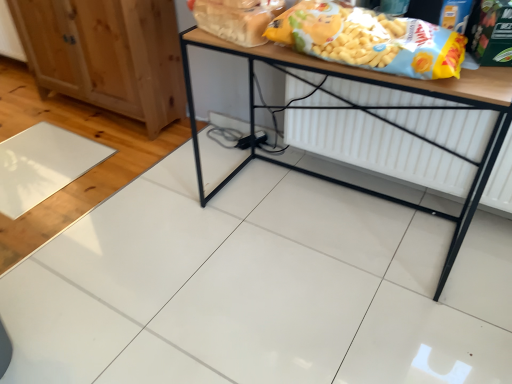
What is the approximate height of white matte radiator at lower center?

white matte radiator at lower center is 16.61 inches in height.

The height and width of the screenshot is (384, 512). I want to click on yellow matte cereal at upper right, positioned as the second cereal in left-to-right order, so click(370, 40).

What do you see at coordinates (106, 54) in the screenshot?
I see `natural wood cabinet at left` at bounding box center [106, 54].

I want to click on translucent plastic bag of bread at upper center, positioned as the second cereal in right-to-left order, so click(x=236, y=18).

From a real-world perspective, is natural wood cabinet at left positioned under translucent plastic bag of bread at upper center, which is counted as the 1th cereal, starting from the left, based on gravity?

Indeed, from a real-world perspective, natural wood cabinet at left is positioned beneath translucent plastic bag of bread at upper center, which is counted as the 1th cereal, starting from the left.

Visually, is natural wood cabinet at left positioned to the left or to the right of translucent plastic bag of bread at upper center, which is counted as the 1th cereal, starting from the left?

From the image, it's evident that natural wood cabinet at left is to the left of translucent plastic bag of bread at upper center, which is counted as the 1th cereal, starting from the left.

How far apart are natural wood cabinet at left and translucent plastic bag of bread at upper center, positioned as the second cereal in right-to-left order?

natural wood cabinet at left is 38.53 inches away from translucent plastic bag of bread at upper center, positioned as the second cereal in right-to-left order.

Considering the positions of points (193, 11) and (376, 49), is point (193, 11) farther from camera compared to point (376, 49)?

Yes, it is.

From a real-world perspective, which object rests below the other?

translucent plastic bag of bread at upper center, which is counted as the 1th cereal, starting from the left, from a real-world perspective.

Is translucent plastic bag of bread at upper center, positioned as the second cereal in right-to-left order, wider than yellow matte cereal at upper right, acting as the first cereal starting from the right?

In fact, translucent plastic bag of bread at upper center, positioned as the second cereal in right-to-left order, might be narrower than yellow matte cereal at upper right, acting as the first cereal starting from the right.

How different are the orientations of translucent plastic bag of bread at upper center, which is counted as the 1th cereal, starting from the left, and yellow matte cereal at upper right, positioned as the second cereal in left-to-right order, in degrees?

16.4 degrees.

From a real-world perspective, is yellow matte cereal at upper right, acting as the first cereal starting from the right, physically above natural wood cabinet at left?

Indeed, from a real-world perspective, yellow matte cereal at upper right, acting as the first cereal starting from the right, stands above natural wood cabinet at left.

Does yellow matte cereal at upper right, acting as the first cereal starting from the right, contain natural wood cabinet at left?

Actually, natural wood cabinet at left is outside yellow matte cereal at upper right, acting as the first cereal starting from the right.

Can you confirm if yellow matte cereal at upper right, positioned as the second cereal in left-to-right order, is smaller than natural wood cabinet at left?

Correct, yellow matte cereal at upper right, positioned as the second cereal in left-to-right order, occupies less space than natural wood cabinet at left.

From the image's perspective, is yellow matte cereal at upper right, acting as the first cereal starting from the right, under natural wood cabinet at left?

Yes.

Could you measure the distance between yellow matte cereal at upper right, acting as the first cereal starting from the right, and translucent plastic bag of bread at upper center, which is counted as the 1th cereal, starting from the left?

yellow matte cereal at upper right, acting as the first cereal starting from the right, and translucent plastic bag of bread at upper center, which is counted as the 1th cereal, starting from the left, are 8.55 inches apart from each other.

Is yellow matte cereal at upper right, positioned as the second cereal in left-to-right order, next to translucent plastic bag of bread at upper center, positioned as the second cereal in right-to-left order?

No, yellow matte cereal at upper right, positioned as the second cereal in left-to-right order, is not in contact with translucent plastic bag of bread at upper center, positioned as the second cereal in right-to-left order.

Which object is further away from the camera, yellow matte cereal at upper right, acting as the first cereal starting from the right, or translucent plastic bag of bread at upper center, positioned as the second cereal in right-to-left order?

translucent plastic bag of bread at upper center, positioned as the second cereal in right-to-left order, is behind.

From the image's perspective, is yellow matte cereal at upper right, positioned as the second cereal in left-to-right order, above or below translucent plastic bag of bread at upper center, positioned as the second cereal in right-to-left order?

Based on their image positions, yellow matte cereal at upper right, positioned as the second cereal in left-to-right order, is located beneath translucent plastic bag of bread at upper center, positioned as the second cereal in right-to-left order.

From the image's perspective, is wooden table at center below translucent plastic bag of bread at upper center, which is counted as the 1th cereal, starting from the left?

Yes, from the image's perspective, wooden table at center is below translucent plastic bag of bread at upper center, which is counted as the 1th cereal, starting from the left.

Do you think wooden table at center is within translucent plastic bag of bread at upper center, which is counted as the 1th cereal, starting from the left, or outside of it?

wooden table at center lies outside translucent plastic bag of bread at upper center, which is counted as the 1th cereal, starting from the left.

Could you measure the distance between wooden table at center and translucent plastic bag of bread at upper center, positioned as the second cereal in right-to-left order?

wooden table at center is 15.31 inches from translucent plastic bag of bread at upper center, positioned as the second cereal in right-to-left order.

Locate an element on the screen. This screenshot has height=384, width=512. table in front of the translucent plastic bag of bread at upper center, positioned as the second cereal in right-to-left order is located at coordinates (371, 113).

From the image's perspective, which one is positioned lower, wooden table at center or white matte radiator at lower center?

wooden table at center, from the image's perspective.

Which object is thinner, wooden table at center or white matte radiator at lower center?

white matte radiator at lower center.

Is wooden table at center directly adjacent to white matte radiator at lower center?

wooden table at center is not next to white matte radiator at lower center, and they're not touching.

Does wooden table at center appear on the right side of white matte radiator at lower center?

No, wooden table at center is not to the right of white matte radiator at lower center.

Looking at this image, from a real-world perspective, which is physically below, wooden table at center or natural wood cabinet at left?

From a 3D spatial view, natural wood cabinet at left is below.

How much distance is there between wooden table at center and natural wood cabinet at left?

wooden table at center is 23.66 inches from natural wood cabinet at left.

Considering the sizes of objects wooden table at center and natural wood cabinet at left in the image provided, who is taller, wooden table at center or natural wood cabinet at left?

Standing taller between the two is wooden table at center.

What's the angular difference between wooden table at center and natural wood cabinet at left's facing directions?

1.52 degrees separate the facing orientations of wooden table at center and natural wood cabinet at left.

In order to click on cabinetry that is under the translucent plastic bag of bread at upper center, positioned as the second cereal in right-to-left order (from a real-world perspective) in this screenshot , I will do `click(106, 54)`.

At what (x,y) coordinates should I click in order to perform the action: click on cereal behind the yellow matte cereal at upper right, positioned as the second cereal in left-to-right order. Please return your answer as a coordinate pair (x, y). Looking at the image, I should click on coord(236,18).

Consider the image. Considering their positions, is translucent plastic bag of bread at upper center, positioned as the second cereal in right-to-left order, positioned closer to wooden table at center than yellow matte cereal at upper right, positioned as the second cereal in left-to-right order?

yellow matte cereal at upper right, positioned as the second cereal in left-to-right order, is closer to wooden table at center.

Estimate the real-world distances between objects in this image. Which object is further from yellow matte cereal at upper right, positioned as the second cereal in left-to-right order, natural wood cabinet at left or white matte radiator at lower center?

natural wood cabinet at left is positioned further to the anchor yellow matte cereal at upper right, positioned as the second cereal in left-to-right order.

Considering their positions, is wooden table at center positioned closer to translucent plastic bag of bread at upper center, which is counted as the 1th cereal, starting from the left, than yellow matte cereal at upper right, positioned as the second cereal in left-to-right order?

Based on the image, yellow matte cereal at upper right, positioned as the second cereal in left-to-right order, appears to be nearer to translucent plastic bag of bread at upper center, which is counted as the 1th cereal, starting from the left.

When comparing their distances from natural wood cabinet at left, does white matte radiator at lower center or wooden table at center seem closer?

Based on the image, wooden table at center appears to be nearer to natural wood cabinet at left.

Based on their spatial positions, is wooden table at center or translucent plastic bag of bread at upper center, which is counted as the 1th cereal, starting from the left, closer to yellow matte cereal at upper right, acting as the first cereal starting from the right?

Among the two, translucent plastic bag of bread at upper center, which is counted as the 1th cereal, starting from the left, is located nearer to yellow matte cereal at upper right, acting as the first cereal starting from the right.

Considering their positions, is natural wood cabinet at left positioned further to translucent plastic bag of bread at upper center, which is counted as the 1th cereal, starting from the left, than wooden table at center?

The object further to translucent plastic bag of bread at upper center, which is counted as the 1th cereal, starting from the left, is natural wood cabinet at left.

Which object lies further to the anchor point natural wood cabinet at left, yellow matte cereal at upper right, acting as the first cereal starting from the right, or wooden table at center?

yellow matte cereal at upper right, acting as the first cereal starting from the right, lies further to natural wood cabinet at left than the other object.

Considering their positions, is translucent plastic bag of bread at upper center, positioned as the second cereal in right-to-left order, positioned further to natural wood cabinet at left than white matte radiator at lower center?

The object further to natural wood cabinet at left is white matte radiator at lower center.

In order to click on table between yellow matte cereal at upper right, acting as the first cereal starting from the right, and white matte radiator at lower center from front to back in this screenshot , I will do `click(371, 113)`.

Locate an element on the screen. cereal between translucent plastic bag of bread at upper center, which is counted as the 1th cereal, starting from the left, and white matte radiator at lower center, in the horizontal direction is located at coordinates (370, 40).

The image size is (512, 384). Identify the location of cereal between translucent plastic bag of bread at upper center, positioned as the second cereal in right-to-left order, and wooden table at center. (370, 40).

What are the coordinates of `table situated between natural wood cabinet at left and white matte radiator at lower center from left to right` in the screenshot? It's located at [x=371, y=113].